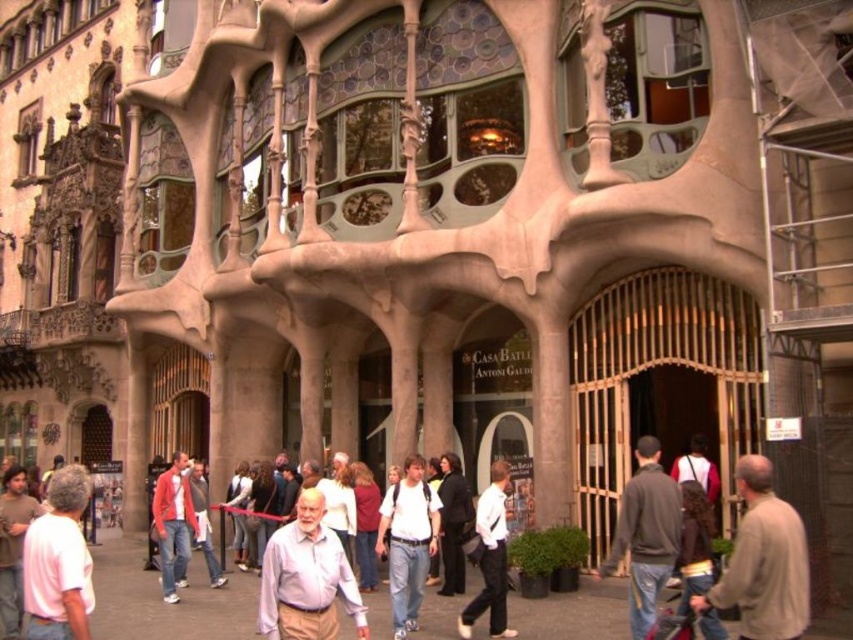
You are a fashion designer looking at a model wearing a dark gray sweater at center and a white matte shirt at center. Which clothing item is visible on top?

The dark gray sweater at center is positioned over the white matte shirt at center, so the dark gray sweater at center is visible on top.

You are a tourist standing in front of Casa Batllot and you see a white cotton shirt at center and a matte red jacket at lower left. Which clothing item is taller?

The white cotton shirt at center is taller than the matte red jacket at lower left.

You are standing in front of Casa Batll? looking at the entrance. There is a point marked at coordinates (645, 534). What object is located at that point?

The point at coordinates (645, 534) corresponds to the dark gray sweater at center.